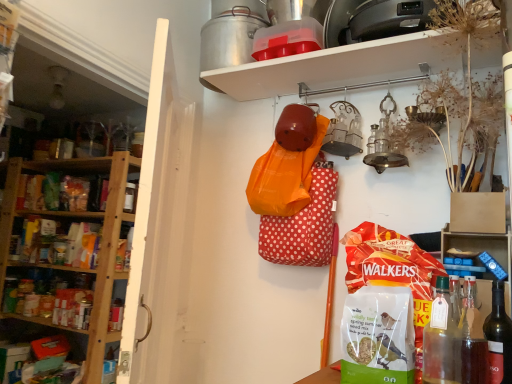
Question: Is white plastic shelf at upper center, which appears as the 1th shelf when viewed from the left, with blue plastic blocks at right, the third shelf from the left?

Choices:
 (A) no
 (B) yes

Answer: (A)

Question: Is white plastic shelf at upper center, which is counted as the third shelf, starting from the right, oriented away from blue plastic blocks at right, the third shelf from the left?

Choices:
 (A) yes
 (B) no

Answer: (B)

Question: From a real-world perspective, is white plastic shelf at upper center, which appears as the 1th shelf when viewed from the left, positioned over blue plastic blocks at right, the third shelf from the left, based on gravity?

Choices:
 (A) yes
 (B) no

Answer: (A)

Question: Does white plastic shelf at upper center, which appears as the 1th shelf when viewed from the left, have a lesser height compared to blue plastic blocks at right, the third shelf from the left?

Choices:
 (A) yes
 (B) no

Answer: (B)

Question: From the image's perspective, does white plastic shelf at upper center, which appears as the 1th shelf when viewed from the left, appear lower than blue plastic blocks at right, the third shelf from the left?

Choices:
 (A) no
 (B) yes

Answer: (A)

Question: From a real-world perspective, is transparent glass bottle at lower right, the first bottle positioned from the left, above or below metallic silver at upper center, marked as the 2th shelf in a left-to-right arrangement?

Choices:
 (A) above
 (B) below

Answer: (B)

Question: Is transparent glass bottle at lower right, which is counted as the 3th bottle, starting from the right, in front of or behind metallic silver at upper center, marked as the 2th shelf in a left-to-right arrangement, in the image?

Choices:
 (A) behind
 (B) front

Answer: (B)

Question: Is transparent glass bottle at lower right, which is counted as the 3th bottle, starting from the right, inside the boundaries of metallic silver at upper center, marked as the 2th shelf in a left-to-right arrangement, or outside?

Choices:
 (A) inside
 (B) outside

Answer: (B)

Question: Is transparent glass bottle at lower right, which is counted as the 3th bottle, starting from the right, taller or shorter than metallic silver at upper center, marked as the 2th shelf in a left-to-right arrangement?

Choices:
 (A) tall
 (B) short

Answer: (A)

Question: From the image's perspective, is white plastic shelf at upper center, which appears as the 1th shelf when viewed from the left, above or below translucent glass bottle at lower right, which appears as the 2th bottle when viewed from the right?

Choices:
 (A) above
 (B) below

Answer: (A)

Question: Considering the positions of point (135, 158) and point (465, 296), is point (135, 158) closer or farther from the camera than point (465, 296)?

Choices:
 (A) farther
 (B) closer

Answer: (A)

Question: Is white plastic shelf at upper center, which appears as the 1th shelf when viewed from the left, taller or shorter than translucent glass bottle at lower right, which appears as the 2th bottle when viewed from the right?

Choices:
 (A) tall
 (B) short

Answer: (A)

Question: In terms of width, does white plastic shelf at upper center, which appears as the 1th shelf when viewed from the left, look wider or thinner when compared to translucent glass bottle at lower right, which appears as the 2th bottle when viewed from the right?

Choices:
 (A) thin
 (B) wide

Answer: (B)

Question: In terms of height, does translucent glass bottle at lower right, which is the 2th bottle from left to right, look taller or shorter compared to blue plastic blocks at right, the third shelf from the left?

Choices:
 (A) tall
 (B) short

Answer: (A)

Question: Considering their positions, is translucent glass bottle at lower right, which is the 2th bottle from left to right, located in front of or behind blue plastic blocks at right, arranged as the first shelf when viewed from the right?

Choices:
 (A) front
 (B) behind

Answer: (A)